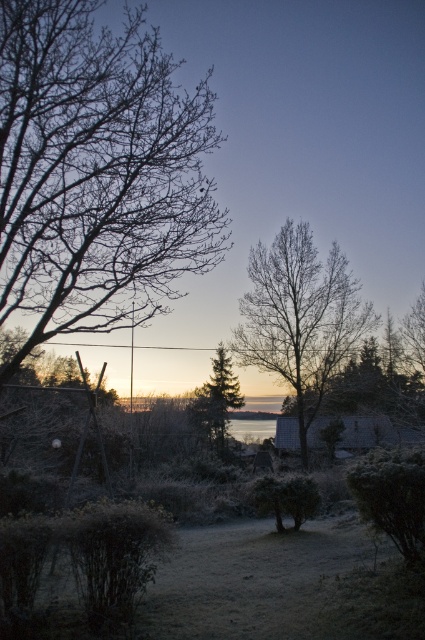
Question: Which point is farther from the camera taking this photo?

Choices:
 (A) (105, 164)
 (B) (260, 364)

Answer: (B)

Question: Does bare branches at left appear over bare branches at center?

Choices:
 (A) yes
 (B) no

Answer: (A)

Question: Estimate the real-world distances between objects in this image. Which object is closer to the bare branches at left?

Choices:
 (A) bare branches at center
 (B) green textured pine tree at center

Answer: (A)

Question: Which point is farther to the camera?

Choices:
 (A) bare branches at left
 (B) bare branches at center
 (C) green textured pine tree at center

Answer: (C)

Question: Does bare branches at left have a greater width compared to green textured pine tree at center?

Choices:
 (A) no
 (B) yes

Answer: (B)

Question: Is bare branches at left below green textured pine tree at center?

Choices:
 (A) no
 (B) yes

Answer: (A)